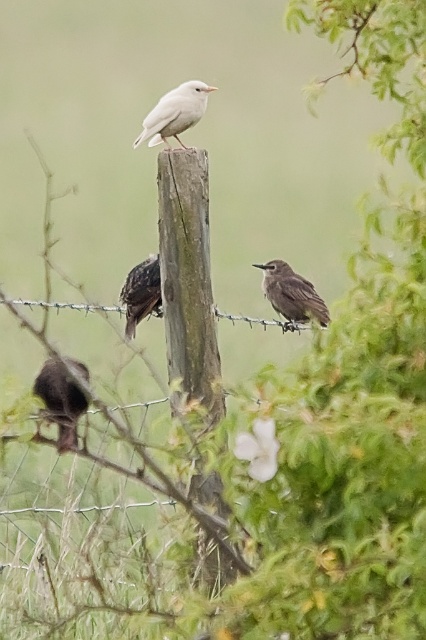
Question: Among these objects, which one is nearest to the camera?

Choices:
 (A) dark brown feathers at lower left
 (B) weathered wood post at center
 (C) barbed wire at center

Answer: (A)

Question: Which object appears closest to the camera in this image?

Choices:
 (A) wire mesh at center
 (B) white matte bird at center

Answer: (B)

Question: Can you confirm if dark brown feathers at lower left is thinner than brown matte bird at center?

Choices:
 (A) yes
 (B) no

Answer: (A)

Question: Which point is farther from the camera taking this photo?

Choices:
 (A) (72, 412)
 (B) (322, 316)

Answer: (B)

Question: Is brown matte bird at center above barbed wire at center?

Choices:
 (A) yes
 (B) no

Answer: (A)

Question: Is dark brown feathers at lower left thinner than brown matte bird at center?

Choices:
 (A) no
 (B) yes

Answer: (B)